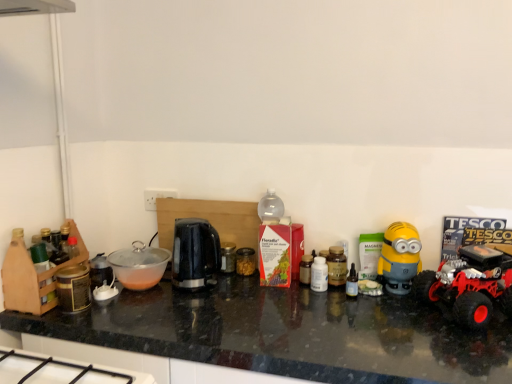
Where is `free space in front of brown glass bottle at center, the 3th bottle when ordered from left to right`? Image resolution: width=512 pixels, height=384 pixels. free space in front of brown glass bottle at center, the 3th bottle when ordered from left to right is located at coordinates (370, 310).